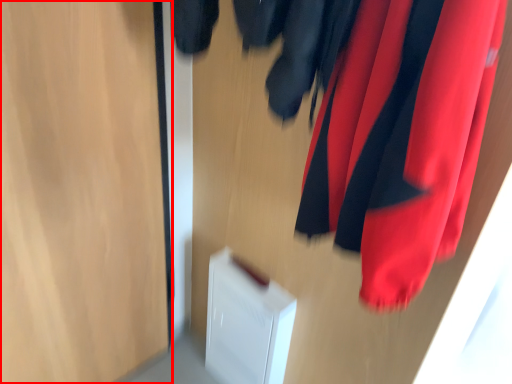
Question: From the image's perspective, what is the correct spatial positioning of glass door (annotated by the red box) in reference to curtain?

Choices:
 (A) above
 (B) below

Answer: (B)